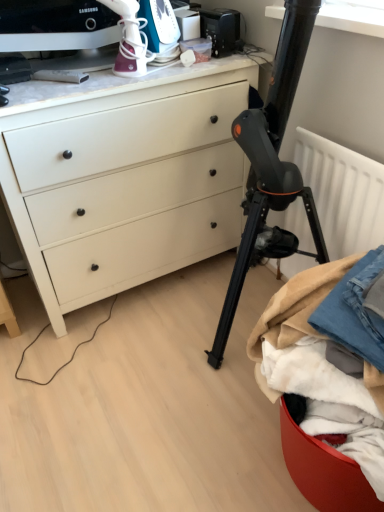
Locate an element on the screen. The image size is (384, 512). free space above white textured radiator at right (from a real-world perspective) is located at coordinates (352, 140).